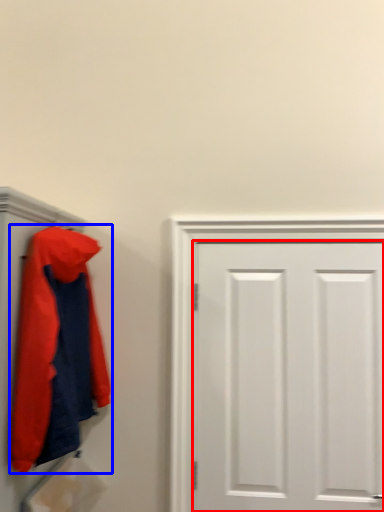
Question: Which point is closer to the camera, door (highlighted by a red box) or jacket (highlighted by a blue box)?

Choices:
 (A) door
 (B) jacket

Answer: (B)